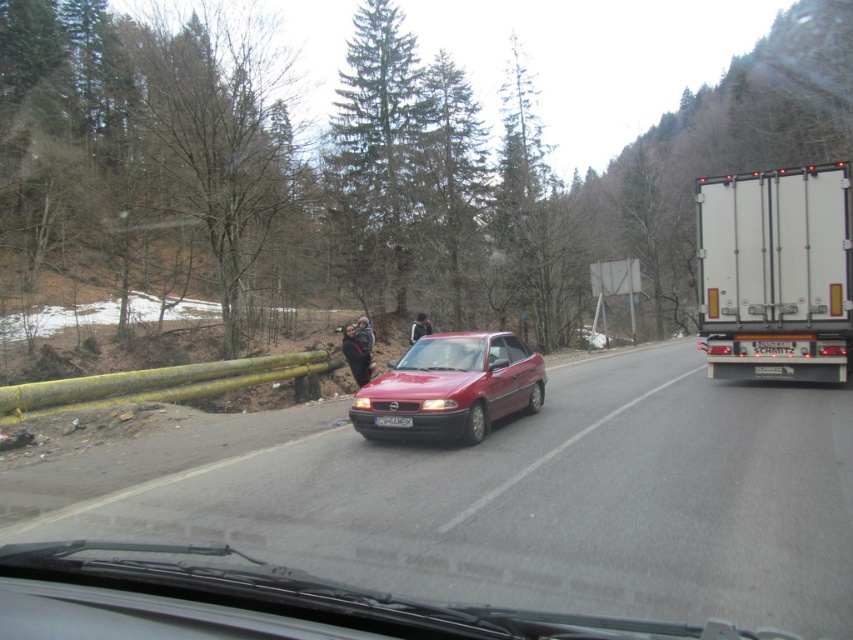
You are driving a car and need to pass a white matte truck at right that is parked on the side of the road. The matte red car at center is in front of you. Can your car safely pass the truck if the road is narrow?

The white matte truck at right is wider than the matte red car at center. Since the road is narrow, passing the truck may be unsafe due to its greater width, so it is advisable to wait until the truck moves or find an alternative route.

You are driving a car and need to park behind the matte red car at center. The parking spot behind it can only accommodate vehicles wider than the black leather jacket at center. Can your car fit?

The matte red car at center is narrower than the black leather jacket at center, so if your car is as wide as the matte red car at center, it would not fit into the parking spot which requires vehicles wider than the black leather jacket at center. Therefore, it cannot fit.

You are driving a car and see the white matte truck at right at point (776, 272). Is the truck in front of or behind your current position?

The white matte truck at right is located at point (776, 272), which is behind your current position since the coordinates are based on the image frame where lower values indicate closer proximity.